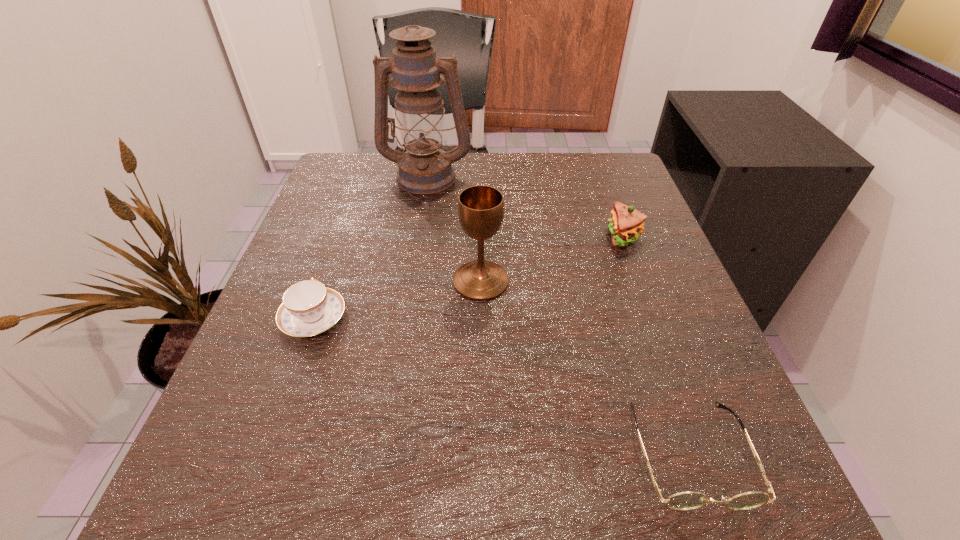
Where is `unoccupied area between the sandwich and the nearest object`? unoccupied area between the sandwich and the nearest object is located at coordinates (657, 345).

This screenshot has width=960, height=540. Find the location of `vacant point located between the second shortest object and the fourth shortest object`. vacant point located between the second shortest object and the fourth shortest object is located at coordinates (397, 300).

You are a GUI agent. You are given a task and a screenshot of the screen. Output one action in this format:
    pyautogui.click(x=<x>, y=<y>)
    Task: Click on the unoccupied position between the spectacles and the fourth tallest object
    This screenshot has width=960, height=540.
    Given the screenshot: What is the action you would take?
    pyautogui.click(x=502, y=386)

Locate an element on the screen. Image resolution: width=960 pixels, height=540 pixels. free space between the chalice and the nearest object is located at coordinates [586, 367].

This screenshot has width=960, height=540. Find the location of `free space between the tallest object and the third shortest object`. free space between the tallest object and the third shortest object is located at coordinates (524, 207).

This screenshot has width=960, height=540. I want to click on free space that is in between the fourth tallest object and the farthest object, so point(370,247).

Where is `empty space between the chalice and the sandwich`? The image size is (960, 540). empty space between the chalice and the sandwich is located at coordinates (552, 259).

Where is `free area in between the teacup and the fourth shortest object`? This screenshot has height=540, width=960. free area in between the teacup and the fourth shortest object is located at coordinates (397, 300).

Identify the location of free space between the shortest object and the second shortest object. This screenshot has height=540, width=960. (502, 386).

This screenshot has width=960, height=540. I want to click on object identified as the fourth closest to the shortest object, so click(425, 169).